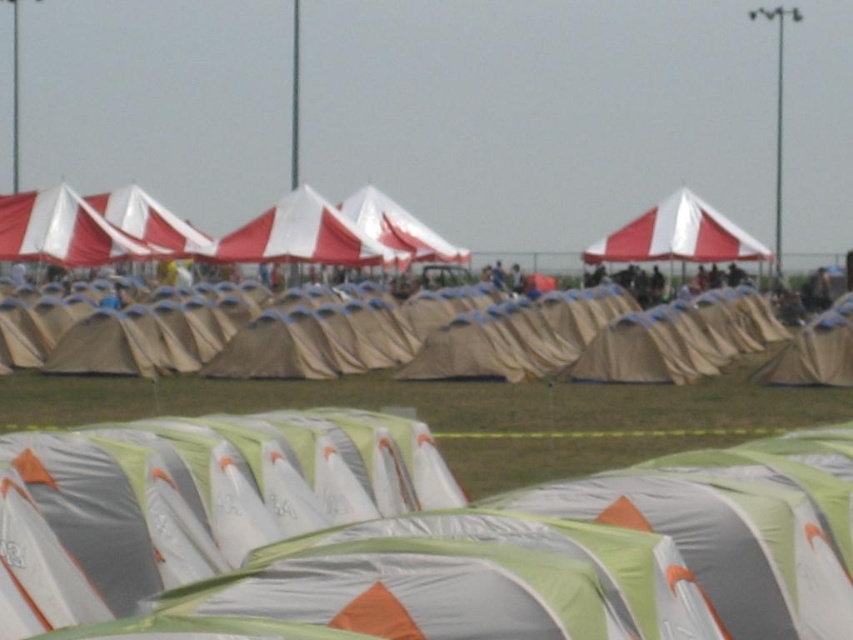
Is point (505, 324) in front of point (21, 225)?

Yes.

Identify the location of beige canvas tent at center. (509, 339).

Can you confirm if white/red striped canopy at upper left is positioned above white fabric canopy at center?

No, white/red striped canopy at upper left is not above white fabric canopy at center.

The height and width of the screenshot is (640, 853). Describe the element at coordinates (61, 230) in the screenshot. I see `white/red striped canopy at upper left` at that location.

Does point (70, 252) come in front of point (364, 220)?

Yes, point (70, 252) is in front of point (364, 220).

You are a GUI agent. You are given a task and a screenshot of the screen. Output one action in this format:
    pyautogui.click(x=<x>, y=<y>)
    Task: Click on the white/red striped canopy at upper left
    The image size is (853, 640).
    Given the screenshot: What is the action you would take?
    pyautogui.click(x=61, y=230)

Is green fabric tent at center smaller than red/white striped canopy at upper center?

Yes, green fabric tent at center is smaller than red/white striped canopy at upper center.

Consider the image. Does green fabric tent at center come behind red/white striped canopy at upper center?

No, green fabric tent at center is closer to the viewer.

Does point (601, 502) lie in front of point (717, 243)?

Yes, it is in front of point (717, 243).

I want to click on green fabric tent at center, so click(x=418, y=532).